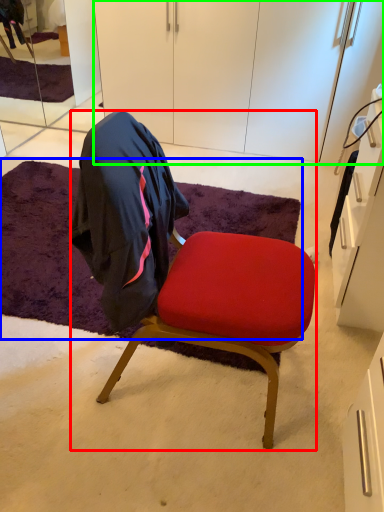
Question: Which object is positioned farthest from chair (highlighted by a red box)? Select from mat (highlighted by a blue box) and cabinetry (highlighted by a green box).

Choices:
 (A) mat
 (B) cabinetry

Answer: (B)